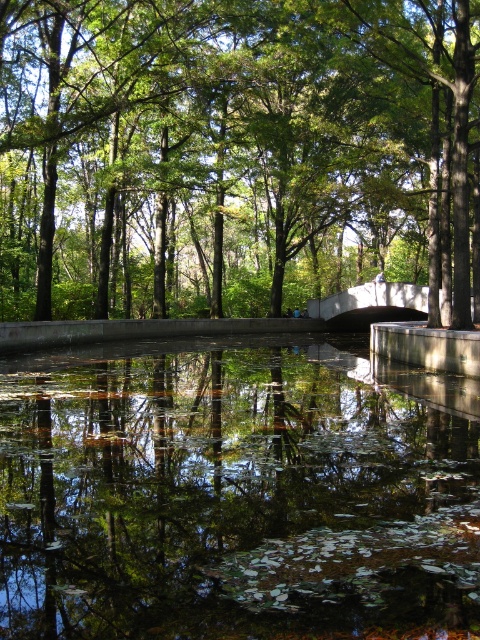
Can you confirm if green leafy tree at center is positioned to the right of transparent water at center?

In fact, green leafy tree at center is to the left of transparent water at center.

Is point (63, 93) closer to viewer compared to point (56, 518)?

No, it is not.

Find the location of a particular element. green leafy tree at center is located at coordinates (236, 154).